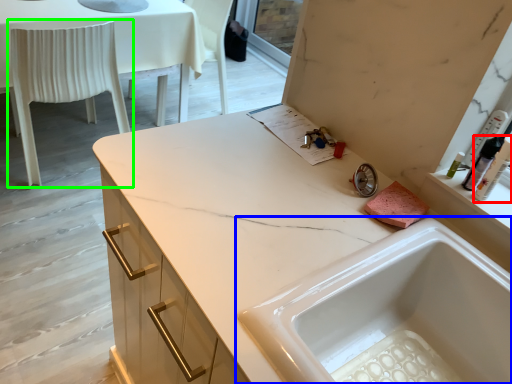
Question: Which is farther away from toiletry (highlighted by a red box)? sink (highlighted by a blue box) or chair (highlighted by a green box)?

Choices:
 (A) sink
 (B) chair

Answer: (B)